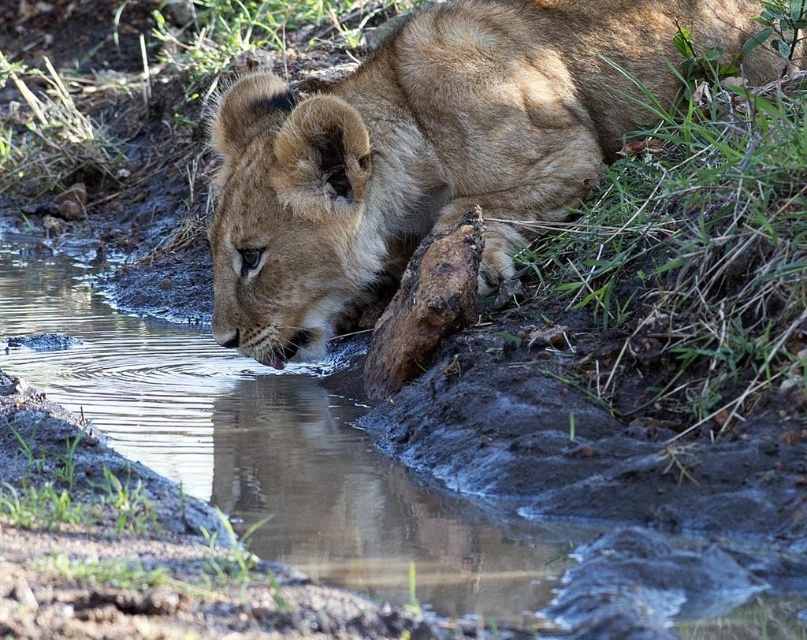
You are a wildlife photographer observing the golden fur lion at center and the brown muddy stream at lower left. Based on their positions, which one is closer to the ground?

The brown muddy stream at lower left is closer to the ground since it is located below the golden fur lion at center.

You are a wildlife photographer trying to capture a photo of the golden fur lion at center and the brown muddy stream at lower left. Based on their sizes, which one should you focus on to ensure both are clearly visible in the frame?

The golden fur lion at center has a smaller size compared to the brown muddy stream at lower left. To ensure both are clearly visible, focus on the golden fur lion at center since it is smaller and requires more attention to detail.

You are a wildlife photographer trying to capture the perfect shot of the golden fur lion at center. Your camera has a focus point at coordinates 0.236, 0.534. Is this focus point likely to help you capture the lion?

The 2D location of golden fur lion at center is at point (429,150), so yes, the focus point at those coordinates will directly align with the lion, making it easier to capture a clear shot.